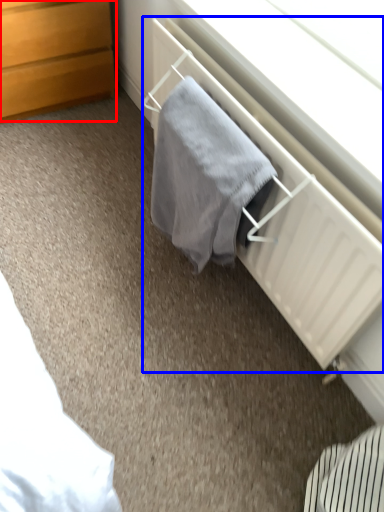
Question: Which point is further to the camera, chest of drawers (highlighted by a red box) or radiator (highlighted by a blue box)?

Choices:
 (A) chest of drawers
 (B) radiator

Answer: (A)